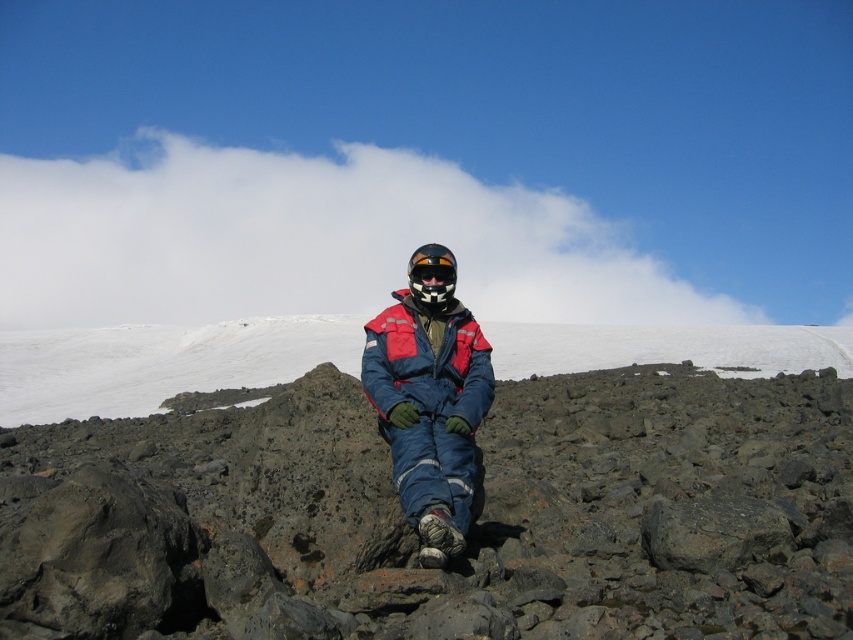
You are a photographer trying to capture a clear shot of the black matte goggles at center. However, the matte blue jacket at center is blocking your view. Can you adjust your position to see the goggles without moving the jacket?

The matte blue jacket at center is in front of the black matte goggles at center, so moving your camera position slightly behind the jacket or tilting the camera upwards might allow you to see the goggles without moving the jacket.